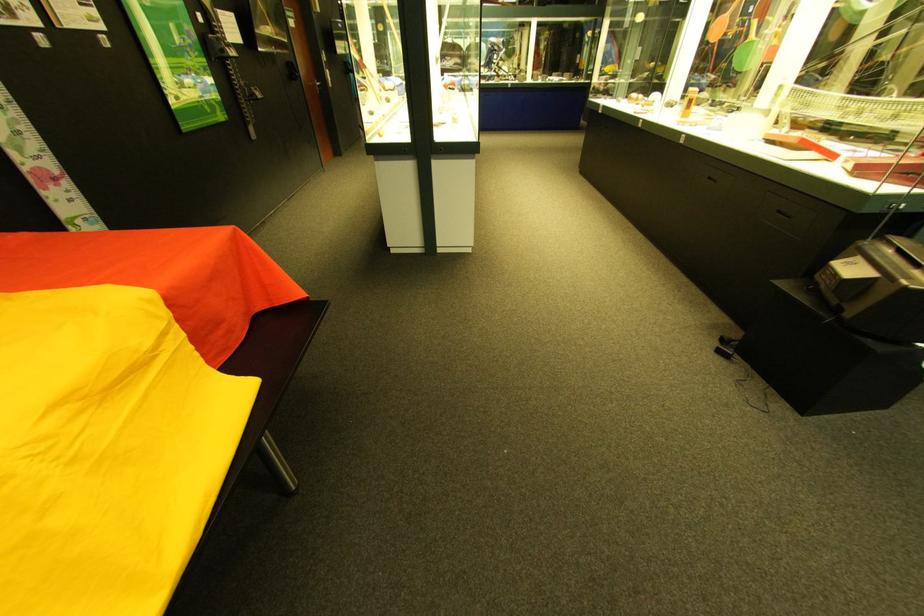
Describe the element at coordinates (292, 71) in the screenshot. I see `the silver door handle` at that location.